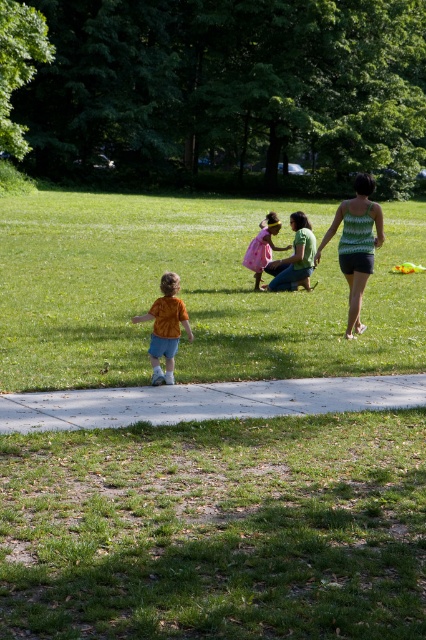
You are standing at the position of the small child in the scene. You want to take a photo of the two points labeled as point (x=210, y=282) and point (x=417, y=390). Which point will appear closer to the camera in your photo?

Point (x=210, y=282) is further to the camera than point (x=417, y=390), so in the photo, point (x=210, y=282) will appear closer to the camera than point (x=417, y=390).